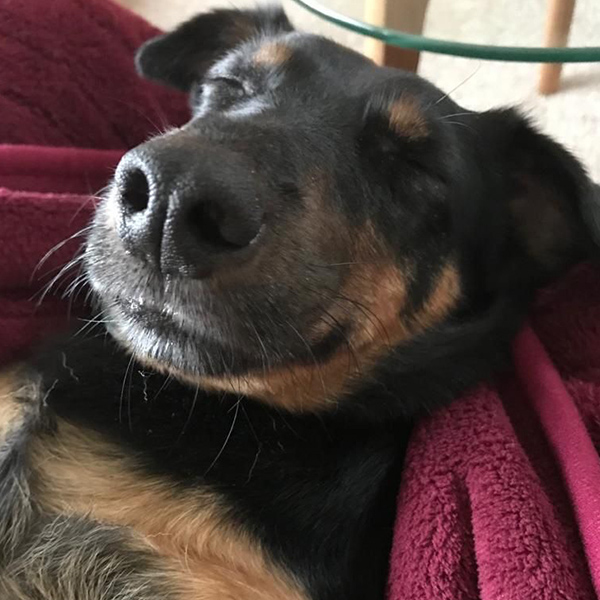
Where is `rug`? rug is located at coordinates (579, 140).